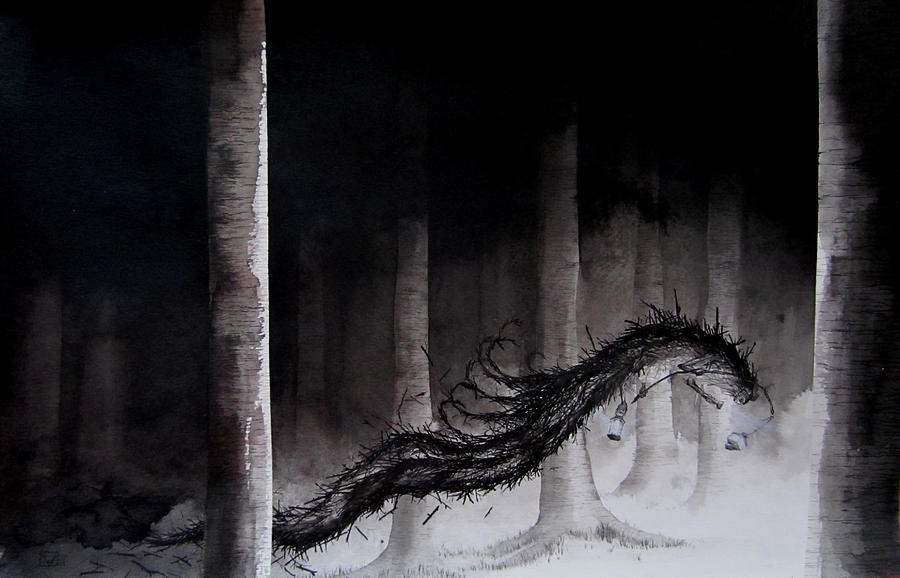
This screenshot has height=578, width=900. Identify the location of right side light. (610, 434).